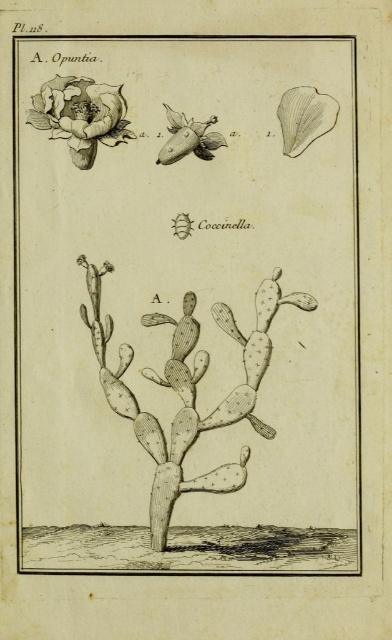
Find the location of a particular element. grayish-brown spiny cactus at center is located at coordinates (188, 390).

Between grayish-brown spiny cactus at center and smooth white flower at upper left, which one appears on the left side from the viewer's perspective?

smooth white flower at upper left

At what (x,y) coordinates should I click in order to perform the action: click on grayish-brown spiny cactus at center. Please return your answer as a coordinate pair (x, y). This screenshot has height=640, width=392. Looking at the image, I should click on (188, 390).

You are a GUI agent. You are given a task and a screenshot of the screen. Output one action in this format:
    pyautogui.click(x=<x>, y=<y>)
    Task: Click on the grayish-brown spiny cactus at center
    This screenshot has width=392, height=640.
    Given the screenshot: What is the action you would take?
    pyautogui.click(x=188, y=390)

Can you confirm if grayish-brown cactus at center is positioned below matte white flower at center?

Correct, grayish-brown cactus at center is located below matte white flower at center.

Which is in front, point (279, 417) or point (196, 152)?

Point (196, 152) is more forward.

Is point (333, 211) in front of point (161, 157)?

No, it is behind (161, 157).

You are a GUI agent. You are given a task and a screenshot of the screen. Output one action in this format:
    pyautogui.click(x=<x>, y=<y>)
    Task: Click on the grayish-brown cactus at center
    The height and width of the screenshot is (640, 392).
    Given the screenshot: What is the action you would take?
    pyautogui.click(x=186, y=307)

Is point (125, 106) in front of point (208, 154)?

No, (125, 106) is further to viewer.

Between point (92, 93) and point (172, 112), which one is positioned behind?

The point (92, 93) is behind.

Locate an element on the screen. smooth white flower at upper left is located at coordinates (81, 115).